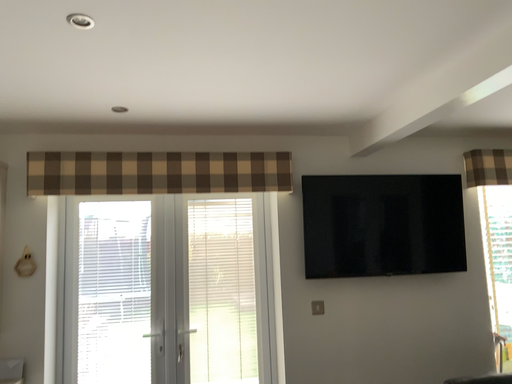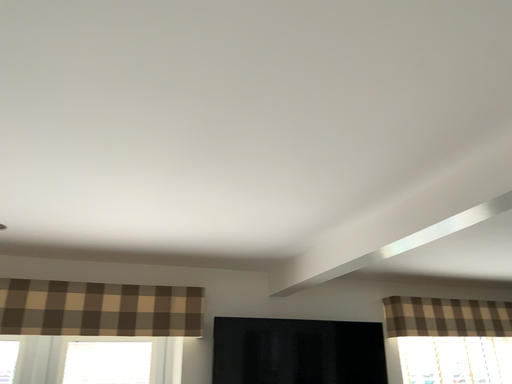
Question: How did the camera likely rotate when shooting the video?

Choices:
 (A) rotated upward
 (B) rotated downward

Answer: (A)